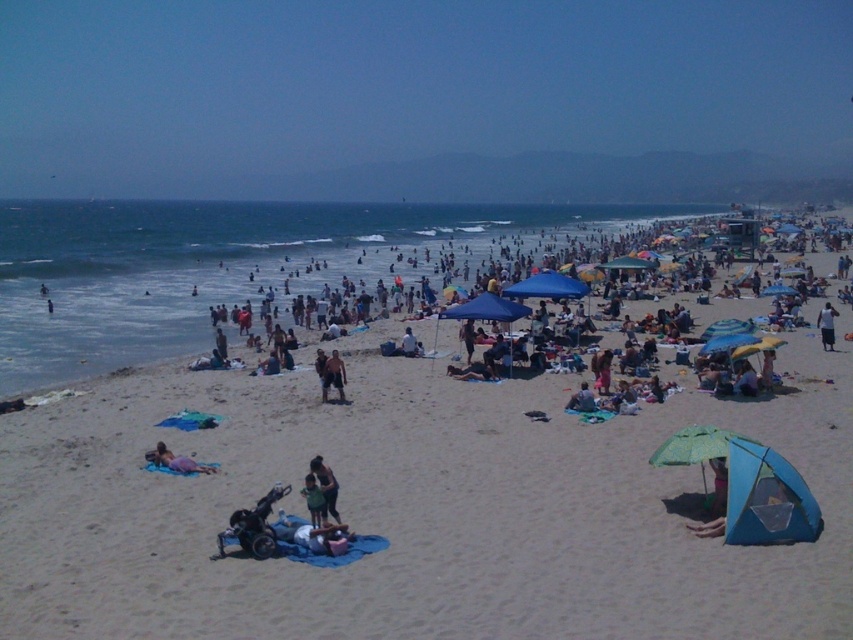
You are standing at the origin point of the coordinate system where the beach scene is mapped. The beachgoers at center are at coordinates approximately 0.428 along the x and 0.370 along the y. If you want to move towards them, in which general direction should you head?

The beachgoers at center are located at coordinates approximately 0.428 along the x and 0.370 along the y. Since you are at the origin, you should move in the positive x and positive y direction to reach them.

You are a photographer trying to capture a photo of the beachgoers at center and the blue fabric umbrella at center. However, you notice that one of them is blocking the view of the other. Which object is blocking the view of the other?

The beachgoers at center are much taller than the blue fabric umbrella at center, so the beachgoers at center are blocking the view of the blue fabric umbrella at center.

You are a beachgoer who wants to find shade. You notice the green fabric shirt at center and the blue fabric tent at lower right. Which object provides shade?

The blue fabric tent at lower right provides shade because the green fabric shirt at center is positioned under it, indicating the tent is overhead.